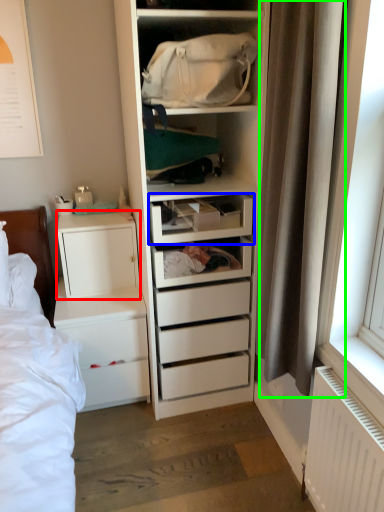
Question: Which object is positioned closest to cabinetry (highlighted by a red box)? Select from drawer (highlighted by a blue box) and curtain (highlighted by a green box).

Choices:
 (A) drawer
 (B) curtain

Answer: (A)